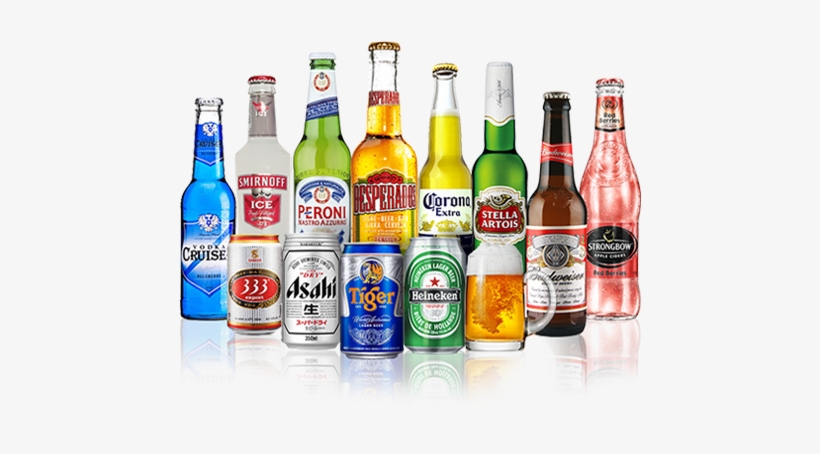
Locate an element on the screen. glass bottles is located at coordinates (197, 185), (251, 164), (328, 159), (390, 165), (443, 175), (499, 198), (554, 201), (622, 210).